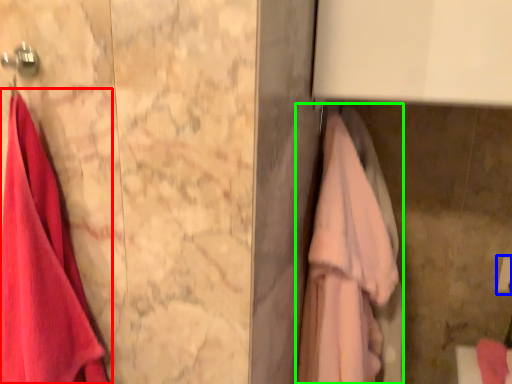
Question: Which object is the farthest from towel (highlighted by a red box)? Choose among these: towel bar (highlighted by a blue box) or towel (highlighted by a green box).

Choices:
 (A) towel bar
 (B) towel

Answer: (A)